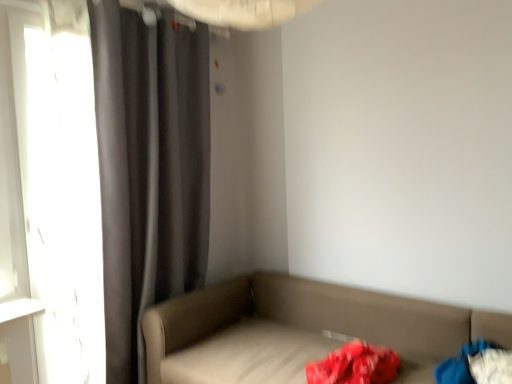
Question: Would you say blue fabric bag at lower right is inside or outside transparent glass window at left?

Choices:
 (A) inside
 (B) outside

Answer: (B)

Question: Is blue fabric bag at lower right in front of or behind transparent glass window at left in the image?

Choices:
 (A) front
 (B) behind

Answer: (A)

Question: Which of these objects is positioned farthest from the dark gray fabric curtain at left?

Choices:
 (A) blue fabric bag at lower right
 (B) transparent glass window at left
 (C) leatherette studio couch at lower right

Answer: (A)

Question: Which of these objects is positioned farthest from the transparent glass window at left?

Choices:
 (A) leatherette studio couch at lower right
 (B) dark gray fabric curtain at left
 (C) blue fabric bag at lower right

Answer: (C)